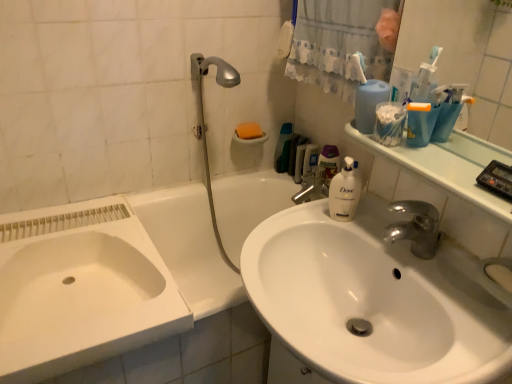
Question: Choose the correct answer: Is white glossy bathtub at center inside blue plastic container at upper right, which is the 2th cleaning product from back to front, or outside it?

Choices:
 (A) inside
 (B) outside

Answer: (B)

Question: From a real-world perspective, is white glossy bathtub at center positioned above or below blue plastic container at upper right, which is the 2th cleaning product from back to front?

Choices:
 (A) above
 (B) below

Answer: (B)

Question: Considering the real-world distances, which object is closest to the white glossy sink at center?

Choices:
 (A) orange sponge at upper center
 (B) white fabric shower curtain at upper center
 (C) white plastic cotton swabs at upper right, which is the 1th mouthwash in front-to-back order
 (D) white glossy bathtub at center
 (E) blue plastic container at upper right, the 1th cleaning product from the front

Answer: (C)

Question: Estimate the real-world distances between objects in this image. Which object is farther from the translucent plastic mouthwash at upper right, which is the 2th mouthwash from right to left?

Choices:
 (A) blue plastic container at upper right, which is the 2th cleaning product from back to front
 (B) orange sponge at upper center
 (C) white glossy bathtub at center
 (D) white fabric shower curtain at upper center
 (E) white glossy sink at center

Answer: (E)